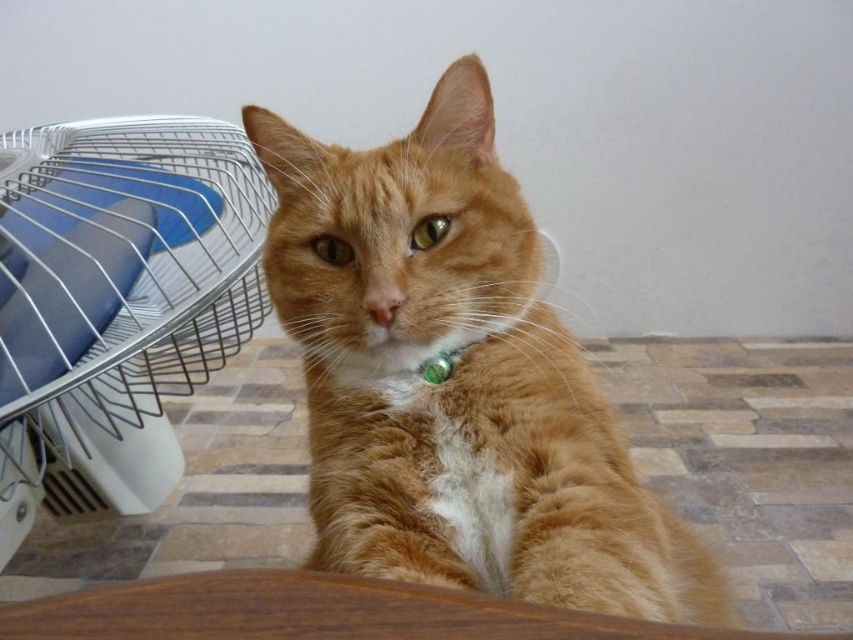
Does point (418, 161) lie in front of point (161, 180)?

Yes, it is.

Is orange fur cat at center taller than white plastic fan at left?

No.

Identify the location of orange fur cat at center. This screenshot has width=853, height=640. (456, 380).

Find the location of `orange fur cat at center`. orange fur cat at center is located at coordinates (456, 380).